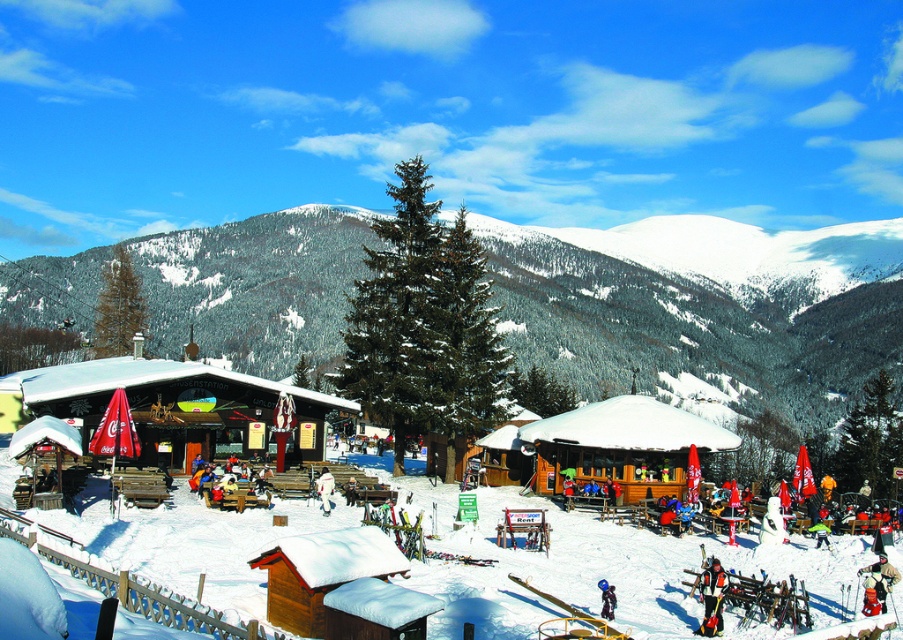
Looking at this image, you are a photographer trying to capture a photo of the green matte pine at center and the wooden tent at center. Which object should you focus on first if you want to ensure both are in the frame without moving the camera?

The green matte pine at center is much taller than the wooden tent at center, so you should focus on the green matte pine at center first to ensure it fits within the frame.

You are a photographer planning to take a photo of the snowy mountain at center and the metallic silver ski at lower center. If you want to ensure both objects are fully visible in the frame, which object should you position closer to the edge of the frame?

The snowy mountain at center might be wider than metallic silver ski at lower center, so you should position the snowy mountain at center closer to the edge of the frame to ensure both are fully visible.

You are standing at the entrance of the ski resort and want to locate two specific points marked on the map. The first point is at coordinate point (61, 515) and the second is at point (477, 340). Which point is closer to you?

Point (61, 515) is closer to the viewer than point (477, 340).